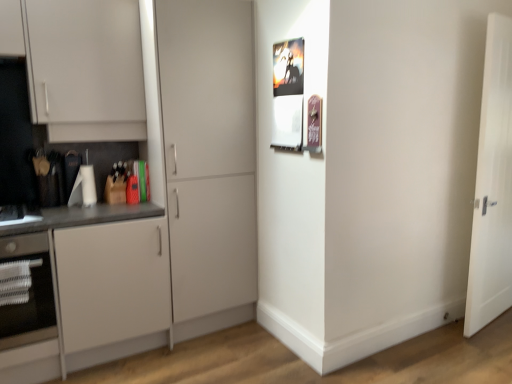
Question: Relative to matte white cabinet at center, which ranks as the first door in left-to-right order, is white matte cabinet at left in front or behind?

Choices:
 (A) front
 (B) behind

Answer: (A)

Question: In terms of width, does white matte cabinet at left look wider or thinner when compared to matte white cabinet at center, which ranks as the first door in left-to-right order?

Choices:
 (A) thin
 (B) wide

Answer: (B)

Question: Based on their relative distances, which object is farther from the white matte cabinet at left?

Choices:
 (A) white glossy oven at lower left
 (B) matte white cabinet at center, arranged as the 2th door when viewed from the right
 (C) white wooden door at right, which is the first door from right to left

Answer: (C)

Question: Estimate the real-world distances between objects in this image. Which object is closer to the matte white cabinet at center, arranged as the 2th door when viewed from the right?

Choices:
 (A) white glossy oven at lower left
 (B) white wooden door at right, marked as the 2th door in a left-to-right arrangement
 (C) white matte cabinet at left

Answer: (C)